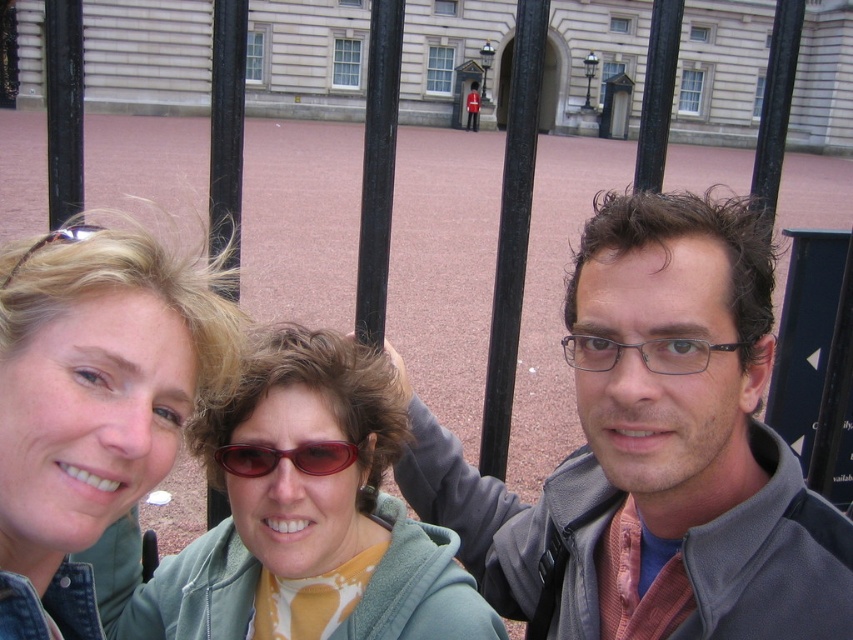
Does matte green hoodie at center have a larger size compared to transparent plastic glasses at center?

Incorrect, matte green hoodie at center is not larger than transparent plastic glasses at center.

Who is higher up, matte green hoodie at center or transparent plastic glasses at center?

transparent plastic glasses at center is above.

Is point (187, 627) closer to viewer compared to point (573, 348)?

Yes.

Find the location of a particular element. matte green hoodie at center is located at coordinates (299, 516).

Which of these two, transparent plastic glasses at center or sunglasses at center, stands taller?

Standing taller between the two is transparent plastic glasses at center.

Is transparent plastic glasses at center taller than sunglasses at center?

Correct, transparent plastic glasses at center is much taller as sunglasses at center.

Does point (589, 369) come in front of point (317, 449)?

Yes.

Where is `transparent plastic glasses at center`? This screenshot has width=853, height=640. transparent plastic glasses at center is located at coordinates (643, 353).

Does gray fleece jacket at center have a lesser width compared to matte green hoodie at center?

No.

Is point (675, 496) more distant than point (114, 621)?

No.

This screenshot has width=853, height=640. Find the location of `gray fleece jacket at center`. gray fleece jacket at center is located at coordinates (654, 456).